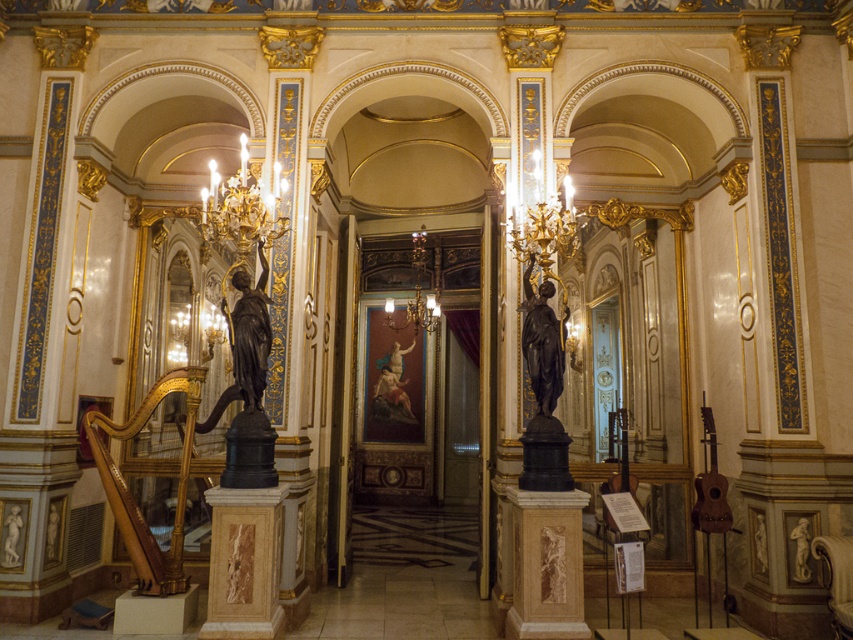
Is gold/gilded chandelier at upper center below bronze statue at center?

No.

Is the position of gold/gilded chandelier at upper center more distant than that of bronze statue at center?

Yes, gold/gilded chandelier at upper center is behind bronze statue at center.

You are a GUI agent. You are given a task and a screenshot of the screen. Output one action in this format:
    pyautogui.click(x=<x>, y=<y>)
    Task: Click on the gold/gilded chandelier at upper center
    Image resolution: width=853 pixels, height=640 pixels.
    Given the screenshot: What is the action you would take?
    pyautogui.click(x=242, y=208)

Can you confirm if bronze statue at center is smaller than black polished statue at center?

Indeed, bronze statue at center has a smaller size compared to black polished statue at center.

Does bronze statue at center appear over black polished statue at center?

Indeed, bronze statue at center is positioned over black polished statue at center.

Between point (267, 330) and point (537, 408), which one is positioned behind?

The point (537, 408) is behind.

At what (x,y) coordinates should I click in order to perform the action: click on bronze statue at center. Please return your answer as a coordinate pair (x, y). The width and height of the screenshot is (853, 640). Looking at the image, I should click on (248, 339).

The height and width of the screenshot is (640, 853). Describe the element at coordinates (242, 208) in the screenshot. I see `gold/gilded chandelier at upper center` at that location.

Where is `gold/gilded chandelier at upper center`? gold/gilded chandelier at upper center is located at coordinates (242, 208).